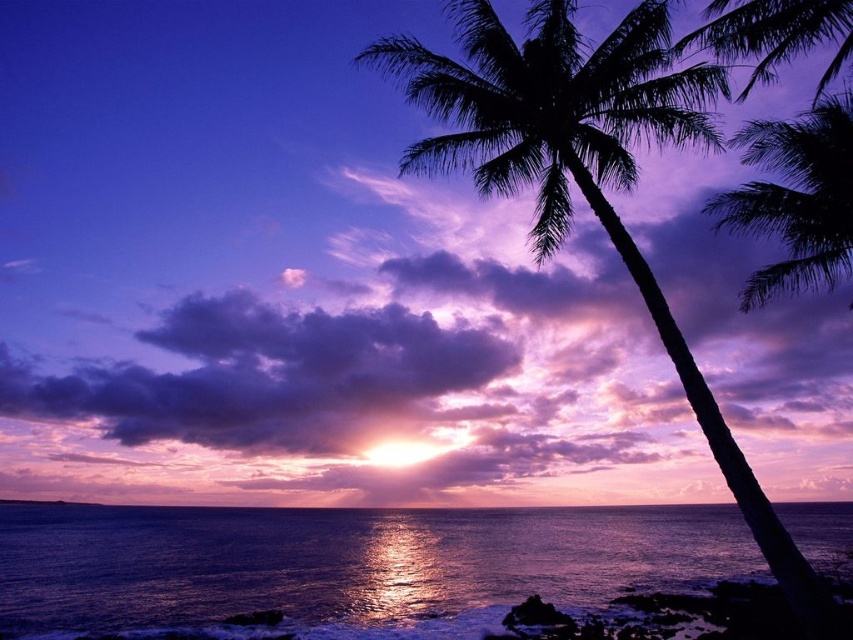
Does silhouette palm tree at right have a lesser width compared to purple fluffy cloud at upper center?

Yes, silhouette palm tree at right is thinner than purple fluffy cloud at upper center.

Which is in front, point (683, 70) or point (426, 332)?

Point (683, 70) is in front.

You are a GUI agent. You are given a task and a screenshot of the screen. Output one action in this format:
    pyautogui.click(x=<x>, y=<y>)
    Task: Click on the silhouette palm tree at right
    This screenshot has width=853, height=640.
    Given the screenshot: What is the action you would take?
    pyautogui.click(x=585, y=173)

Who is more distant from viewer, (254,289) or (383,362)?

The point (254,289) is behind.

In order to click on purple cloud at upper center in this screenshot , I will do `click(318, 342)`.

Is silhouette palm tree at right thinner than silhouette leafy palm at upper right?

Indeed, silhouette palm tree at right has a lesser width compared to silhouette leafy palm at upper right.

Is point (463, 88) positioned behind point (808, 253)?

No.

Where is `silhouette palm tree at right`? Image resolution: width=853 pixels, height=640 pixels. silhouette palm tree at right is located at coordinates (585, 173).